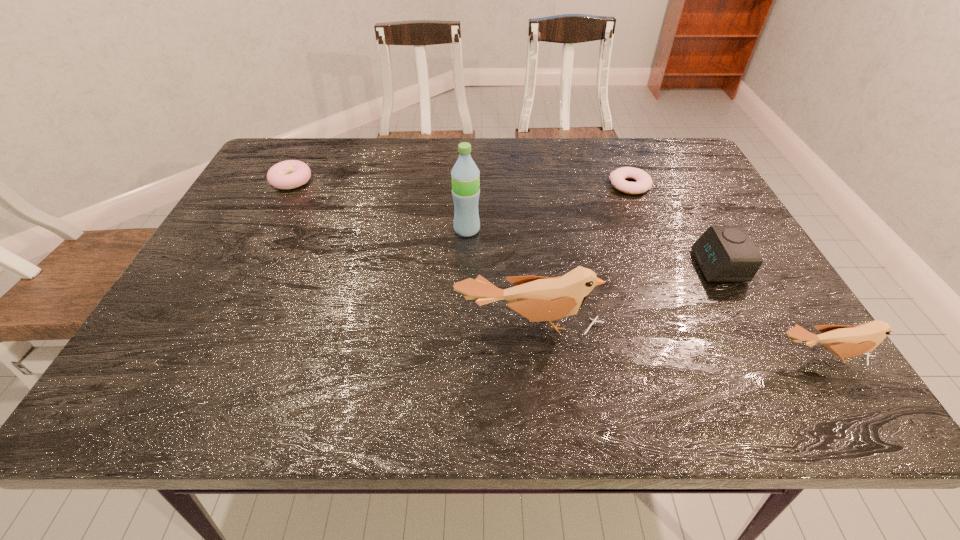
Image resolution: width=960 pixels, height=540 pixels. I want to click on the fifth shortest object, so click(537, 298).

Where is `the second nearest object`? This screenshot has height=540, width=960. the second nearest object is located at coordinates (537, 298).

I want to click on the nearest object, so click(844, 341).

I want to click on the shorter bird, so click(844, 341).

Identify the location of the shortest object. (644, 182).

The height and width of the screenshot is (540, 960). I want to click on the right doughnut, so click(644, 182).

Find the location of a particular element. The width and height of the screenshot is (960, 540). the tallest object is located at coordinates (465, 178).

You are a GUI agent. You are given a task and a screenshot of the screen. Output one action in this format:
    pyautogui.click(x=<x>, y=<y>)
    Task: Click on the water bottle
    Image resolution: width=960 pixels, height=540 pixels.
    Given the screenshot: What is the action you would take?
    pyautogui.click(x=465, y=178)

Locate an element on the screen. the left doughnut is located at coordinates (289, 174).

This screenshot has height=540, width=960. I want to click on the taller doughnut, so click(289, 174).